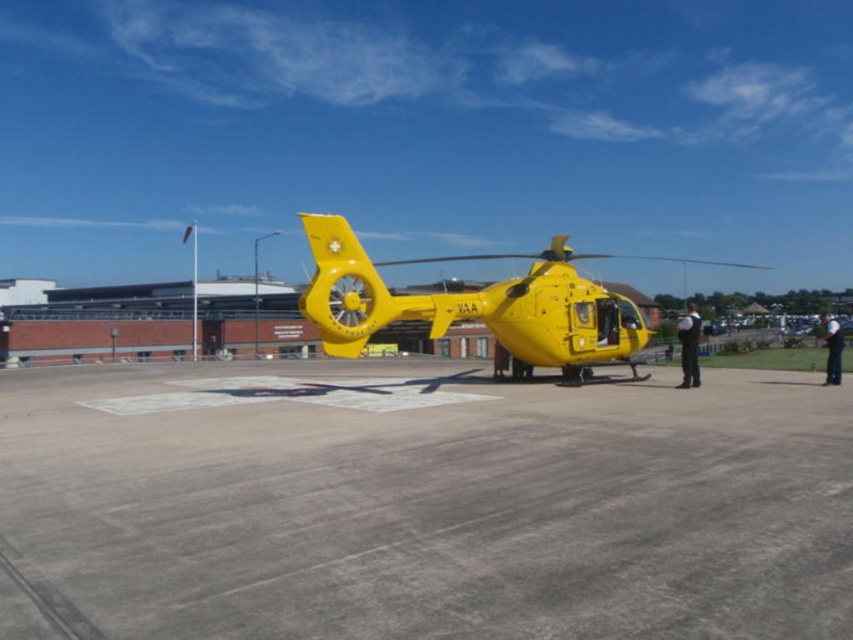
Question: Estimate the real-world distances between objects in this image. Which object is farther from the gray concrete tarmac at center?

Choices:
 (A) yellow matte helicopter at center
 (B) black leather jacket at right

Answer: (A)

Question: Can you confirm if gray concrete tarmac at center is wider than black fabric person at right?

Choices:
 (A) no
 (B) yes

Answer: (A)

Question: Is gray concrete tarmac at center smaller than black fabric person at right?

Choices:
 (A) no
 (B) yes

Answer: (B)

Question: Is black leather jacket at right smaller than black fabric person at right?

Choices:
 (A) yes
 (B) no

Answer: (A)

Question: Which point is closer to the camera?

Choices:
 (A) (682, 342)
 (B) (566, 284)
 (C) (99, 408)

Answer: (C)

Question: Which point appears closest to the camera in this image?

Choices:
 (A) (523, 282)
 (B) (680, 330)

Answer: (B)